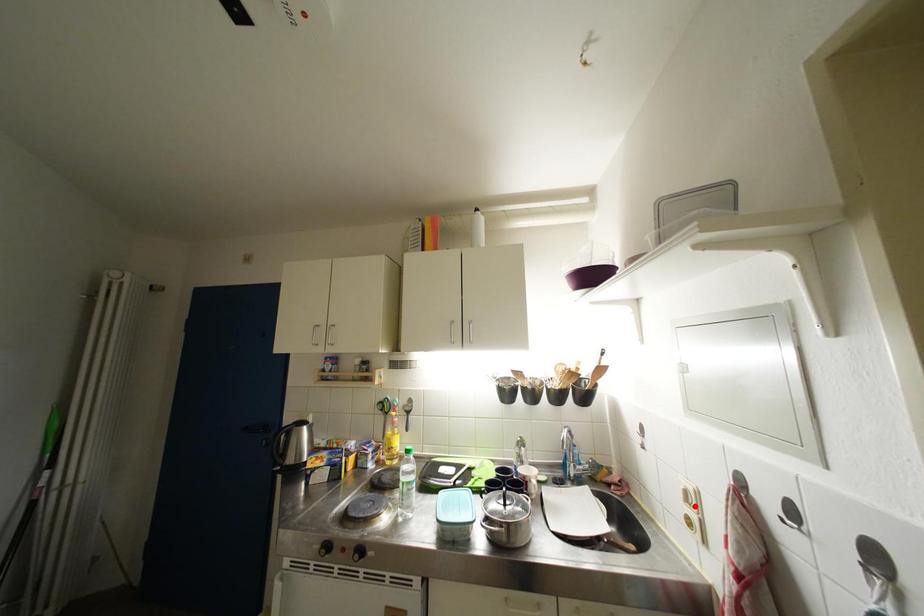
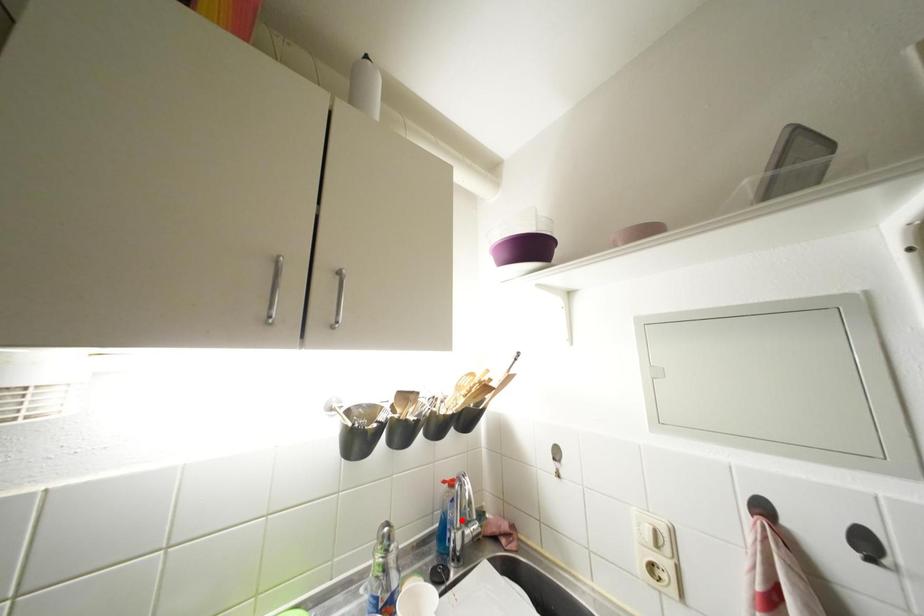
I am providing you with two images of the same scene from different viewpoints. A red point is marked on the first image and another point is marked on the second image. Are the points marked in image1 and image2 representing the same 3D position?

No